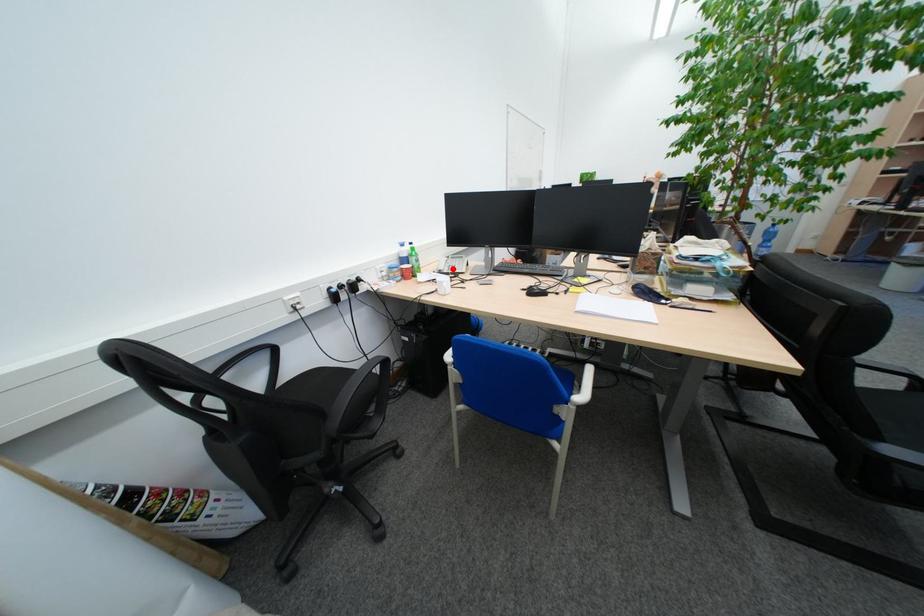
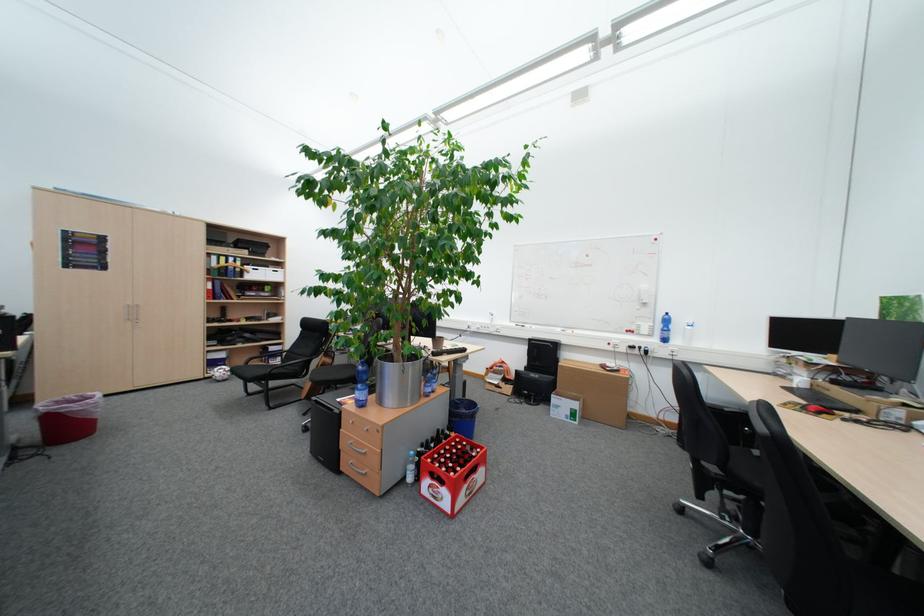
Question: I am providing you with two images of the same scene from different viewpoints. A red point is marked on the first image. Can you still see the location of the red point in image 2?

Choices:
 (A) Yes
 (B) No

Answer: (B)